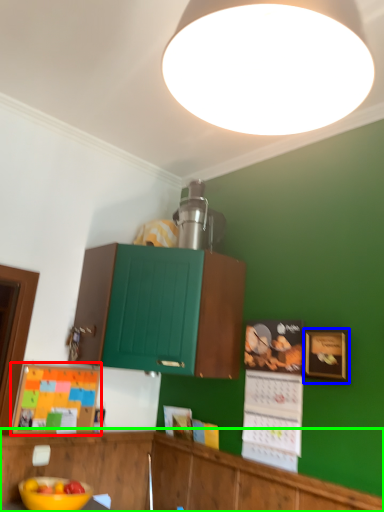
Question: Considering the real-world distances, which object is closest to bulletin board (highlighted by a red box)? picture frame (highlighted by a blue box) or cabinetry (highlighted by a green box).

Choices:
 (A) picture frame
 (B) cabinetry

Answer: (B)